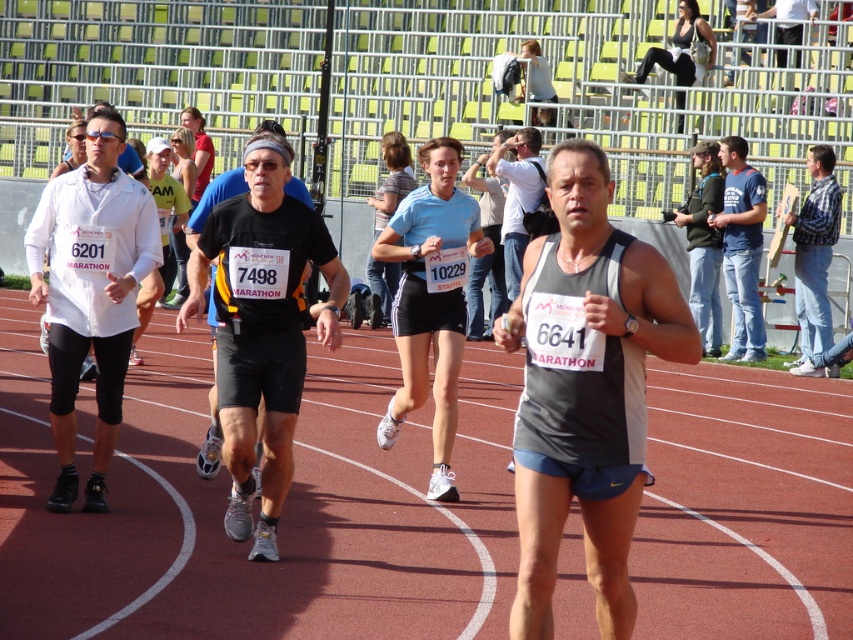
You are a photographer at the marathon and want to capture a photo of the light blue fabric shorts at center and the gray tank top at center. Which clothing item will appear smaller in the photo?

The light blue fabric shorts at center will appear smaller in the photo because it has a lesser height compared to the gray tank top at center.

You are a photographer positioned at the center of the track. You want to take a photo of the light blue fabric shorts at center without the gray fabric tank top at center blocking it. Is it possible?

The gray fabric tank top at center is in front of the light blue fabric shorts at center, so it will block the view. Move to a position where the light blue fabric shorts at center is not behind the gray fabric tank top at center.

You are a photographer positioned at the center of the track. You need to capture a photo of the light blue fabric shorts at center and the gray tank top at center. Which clothing item will appear wider in the photo?

The light blue fabric shorts at center will appear wider in the photo because its width is larger than that of the gray tank top at center.